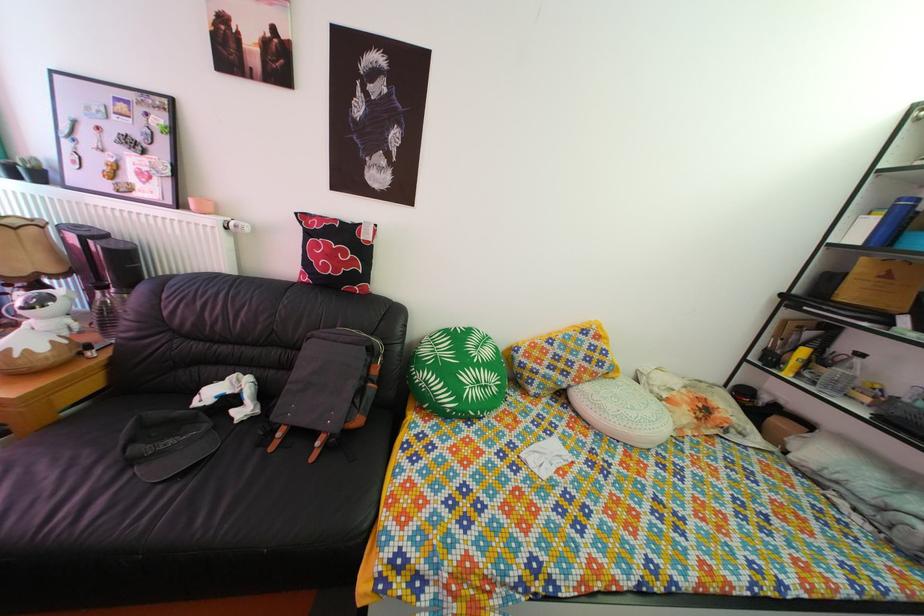
Find where to lift the tall glass bottle. Please return your answer as a coordinate pair (x, y).

(103, 310)